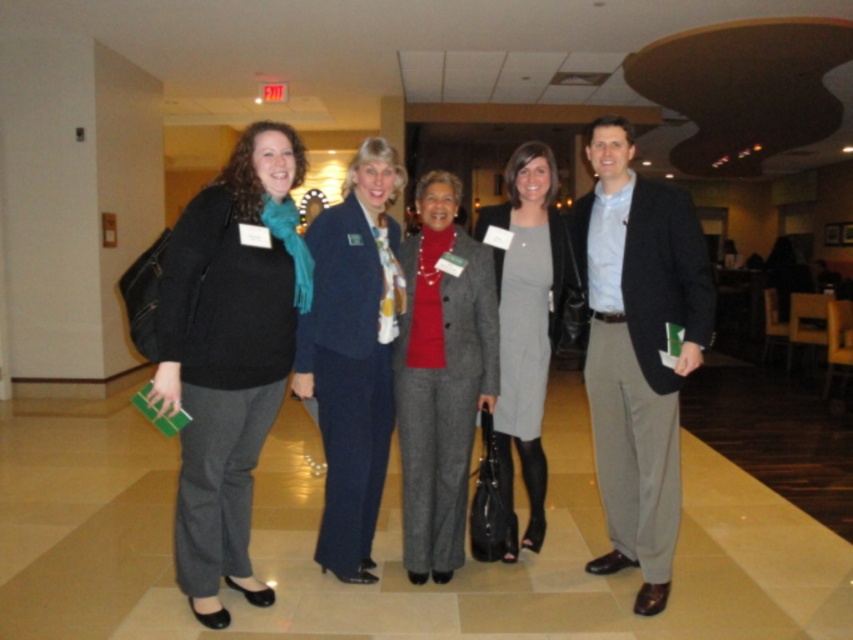
Is point (326, 547) positioned before point (489, 264)?

Yes, point (326, 547) is closer to viewer.

Which is more to the right, navy blue suit at center or gray wool suit at center?

From the viewer's perspective, gray wool suit at center appears more on the right side.

This screenshot has height=640, width=853. In order to click on navy blue suit at center in this screenshot , I will do `click(352, 353)`.

How distant is navy blue suit at center from gray wool dress at center?

navy blue suit at center and gray wool dress at center are 21.47 inches apart.

Can you confirm if navy blue suit at center is wider than gray wool dress at center?

Correct, the width of navy blue suit at center exceeds that of gray wool dress at center.

Does point (312, 284) come closer to viewer compared to point (514, 544)?

Yes, it is in front of point (514, 544).

You are a GUI agent. You are given a task and a screenshot of the screen. Output one action in this format:
    pyautogui.click(x=<x>, y=<y>)
    Task: Click on the navy blue suit at center
    This screenshot has width=853, height=640.
    Given the screenshot: What is the action you would take?
    pyautogui.click(x=352, y=353)

Can you confirm if matte black jacket at left is smaller than matte black blazer at right?

Yes.

Is matte black jacket at left further to the viewer compared to matte black blazer at right?

That is False.

Does point (175, 356) come behind point (608, 298)?

That is False.

Find the location of a particular element. This screenshot has height=640, width=853. matte black jacket at left is located at coordinates (229, 353).